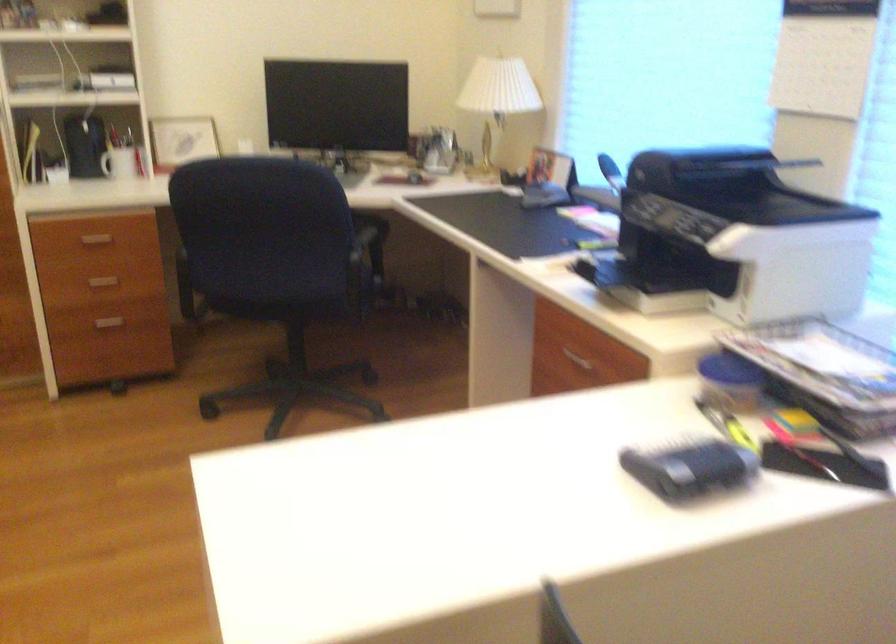
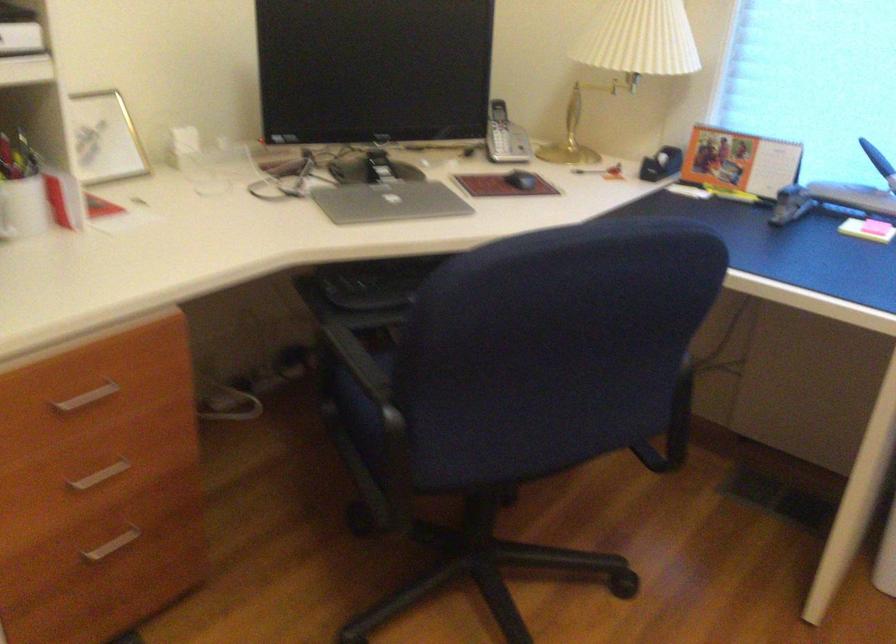
The point at (552, 169) is marked in the first image. Where is the corresponding point in the second image?

(739, 162)